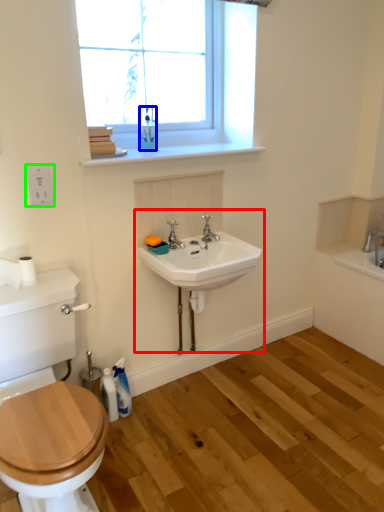
Question: Estimate the real-world distances between objects in this image. Which object is closer to sink (highlighted by a red box), toiletry (highlighted by a blue box) or electric outlet (highlighted by a green box)?

Choices:
 (A) toiletry
 (B) electric outlet

Answer: (A)